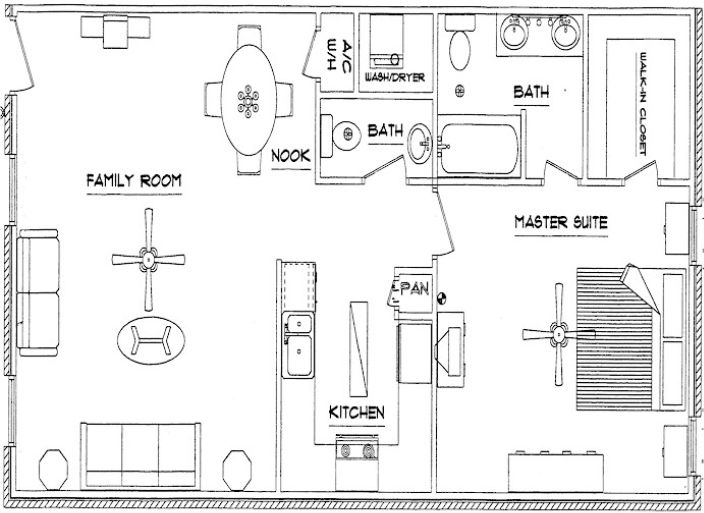
You are a GUI agent. You are given a task and a screenshot of the screen. Output one action in this format:
    pyautogui.click(x=<x>, y=<y>)
    Task: Click on the room you cook in
    The image size is (704, 513).
    Given the screenshot: What is the action you would take?
    pyautogui.click(x=360, y=408)